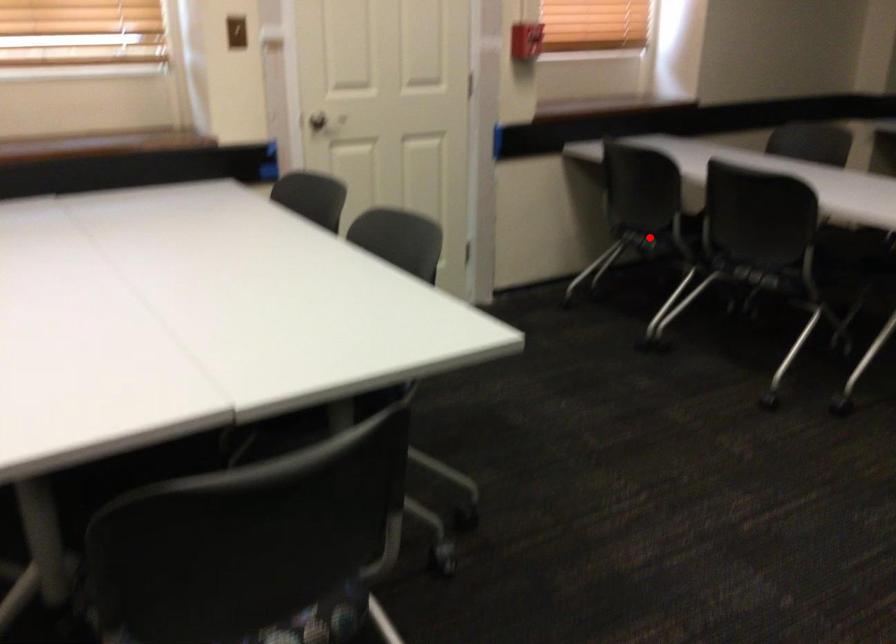
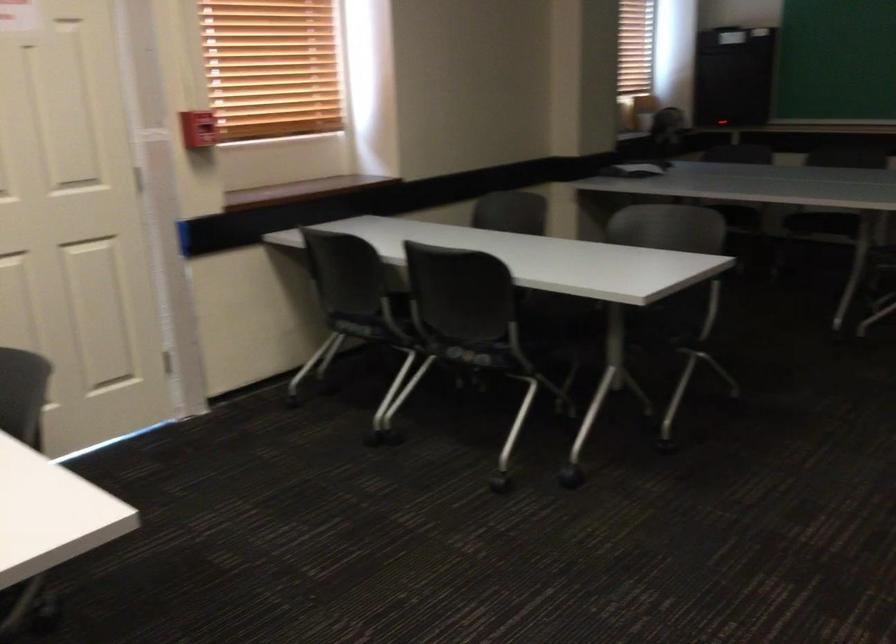
In the second image, find the point that corresponds to the highlighted location in the first image.

(360, 328)